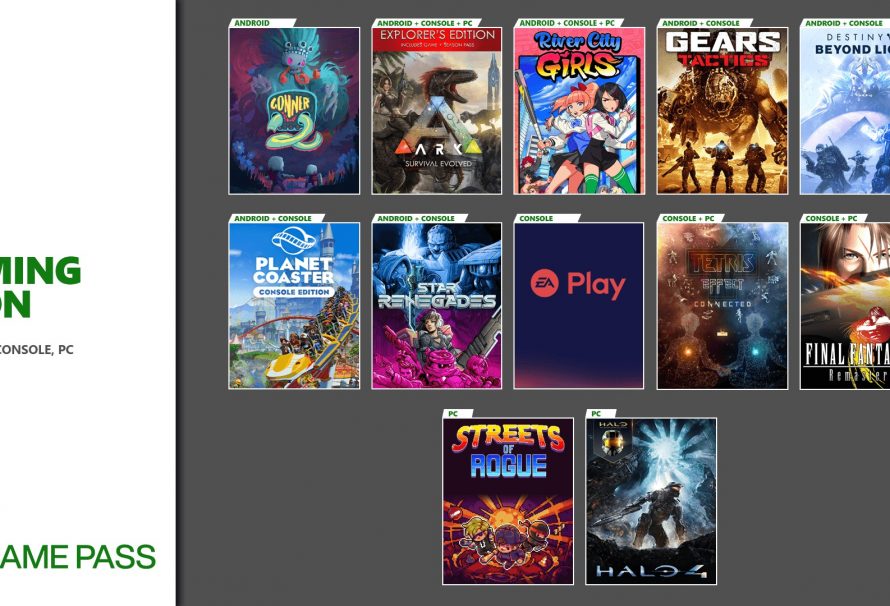
Locate an element on the screen. pc is located at coordinates (451, 419), (596, 416).